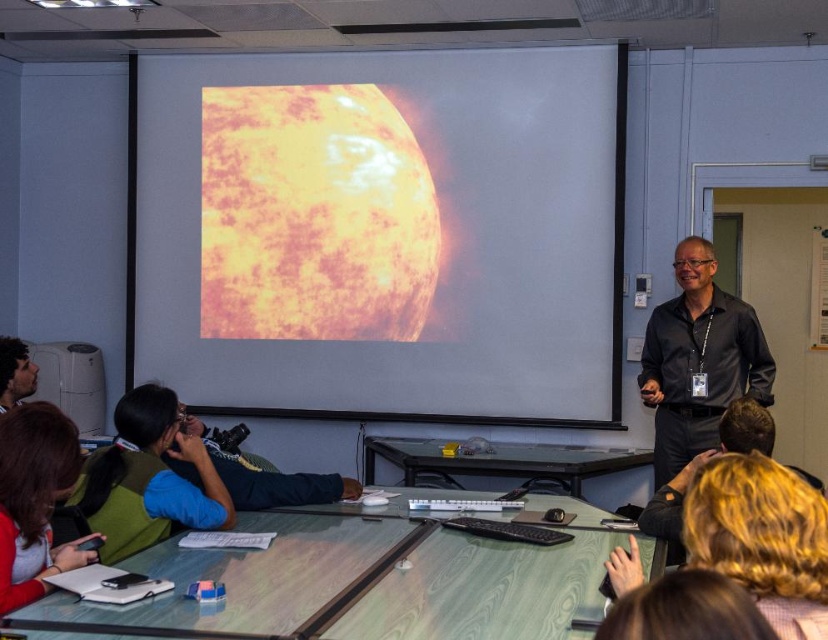
Question: Is black shirt at right positioned at the back of dark brown hair at upper left?

Choices:
 (A) yes
 (B) no

Answer: (A)

Question: Which of the following is the farthest from the observer?

Choices:
 (A) (552, 380)
 (B) (7, 337)
 (C) (496, 577)

Answer: (A)

Question: Is matte yellow screen at upper center closer to the viewer compared to black shirt at right?

Choices:
 (A) yes
 (B) no

Answer: (B)

Question: Is the position of green wood table at lower center less distant than that of black shirt at right?

Choices:
 (A) yes
 (B) no

Answer: (A)

Question: Which of the following is the closest to the observer?

Choices:
 (A) (737, 440)
 (B) (140, 128)
 (C) (408, 465)
 (D) (414, 548)

Answer: (A)

Question: Which object appears farthest from the camera in this image?

Choices:
 (A) black shirt at right
 (B) green wood table at lower center
 (C) black shirt at center

Answer: (A)